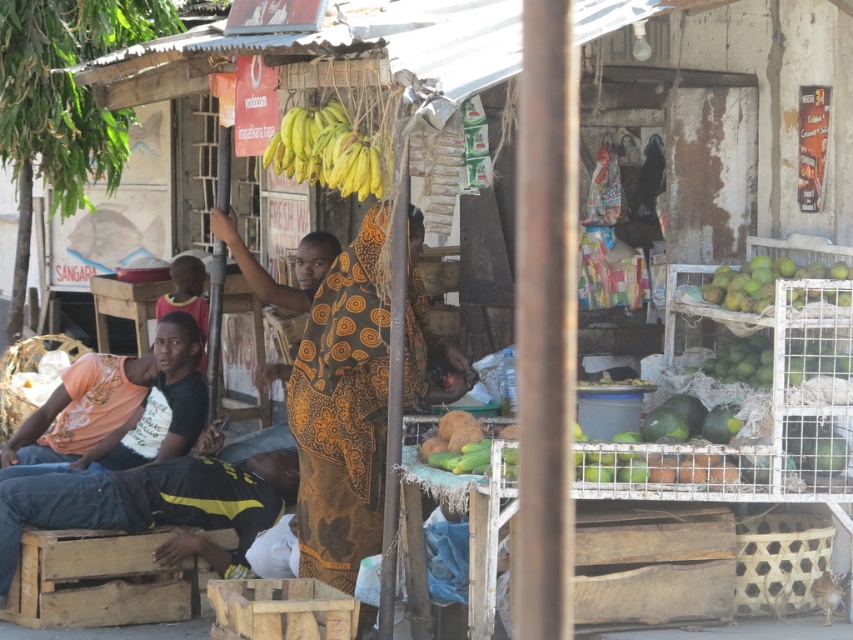
Question: Considering the relative positions of black cotton shirt at lower left and green matte mangoes at right in the image provided, where is black cotton shirt at lower left located with respect to green matte mangoes at right?

Choices:
 (A) below
 (B) above

Answer: (A)

Question: Which object appears farthest from the camera in this image?

Choices:
 (A) orange t-shirt at left
 (B) black cotton shirt at lower left

Answer: (A)

Question: Does black cotton shirt at lower left appear on the right side of yellow matte bananas at center?

Choices:
 (A) no
 (B) yes

Answer: (A)

Question: Is printed fabric dress at center above black cotton shirt at lower left?

Choices:
 (A) no
 (B) yes

Answer: (B)

Question: Which object appears closest to the camera in this image?

Choices:
 (A) printed fabric dress at center
 (B) yellow matte bananas at center

Answer: (B)

Question: Based on their relative distances, which object is farther from the wooden crate at lower left?

Choices:
 (A) orange t-shirt at left
 (B) black cotton shirt at lower left
 (C) brown woven basket at lower right

Answer: (C)